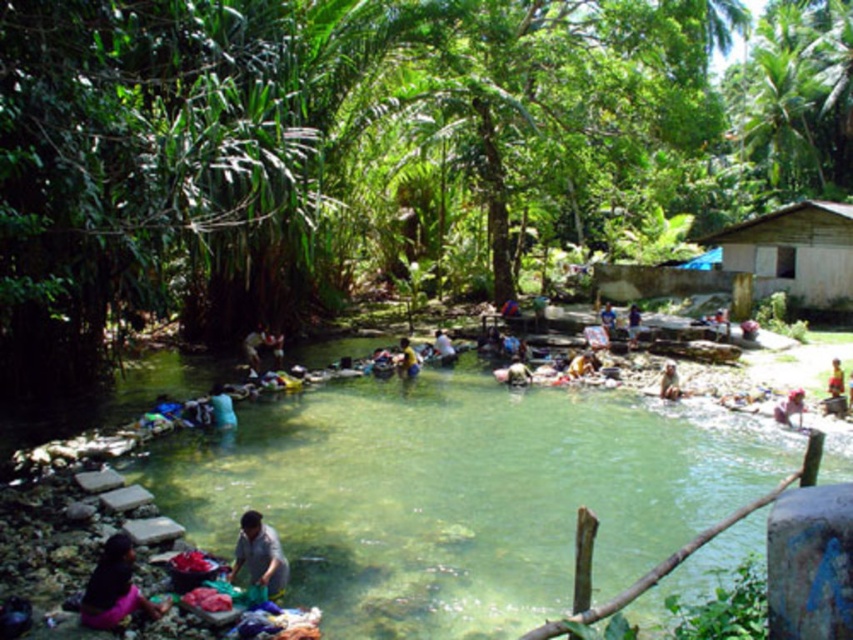
Which is more to the left, clear water stream at center or gray fabric at lower center?

gray fabric at lower center

How much distance is there between clear water stream at center and gray fabric at lower center?

clear water stream at center is 15.67 feet away from gray fabric at lower center.

Where is `clear water stream at center`? This screenshot has height=640, width=853. clear water stream at center is located at coordinates click(462, 493).

Where is `clear water stream at center`? clear water stream at center is located at coordinates (462, 493).

Between pink fabric at lower right and smooth skin person at center, which one appears on the right side from the viewer's perspective?

Positioned to the right is pink fabric at lower right.

Does pink fabric at lower right appear on the left side of smooth skin person at center?

Incorrect, pink fabric at lower right is not on the left side of smooth skin person at center.

Who is more forward, [804,408] or [450,353]?

Point [804,408] is more forward.

This screenshot has height=640, width=853. In order to click on pink fabric at lower right in this screenshot , I will do `click(790, 408)`.

Is brown wooden hut at right positioned at the back of blue fabric at center?

Yes, it is behind blue fabric at center.

Consider the image. Is brown wooden hut at right to the left of blue fabric at center from the viewer's perspective?

Incorrect, brown wooden hut at right is not on the left side of blue fabric at center.

Between point (782, 241) and point (608, 326), which one is positioned in front?

Point (608, 326)

I want to click on brown wooden hut at right, so click(793, 253).